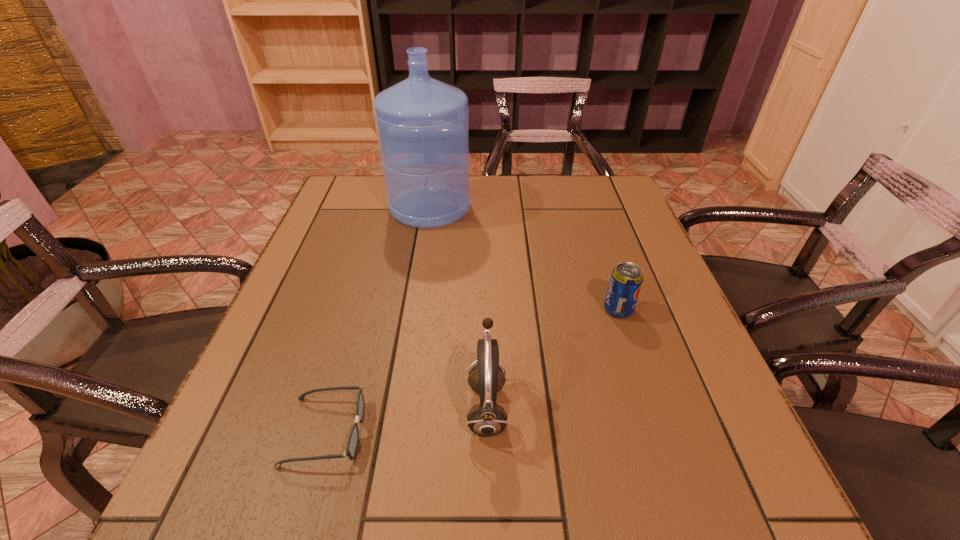
You are a GUI agent. You are given a task and a screenshot of the screen. Output one action in this format:
    pyautogui.click(x=<x>, y=<y>)
    Task: Click on the vacant space located 0.310m on the ear pads of the second tallest object
    This screenshot has height=540, width=960.
    Given the screenshot: What is the action you would take?
    pyautogui.click(x=288, y=407)

Where is `free space located 0.150m on the front of the soda`? free space located 0.150m on the front of the soda is located at coordinates (641, 380).

Where is `free space located 0.220m on the face of the spectacles`? The image size is (960, 540). free space located 0.220m on the face of the spectacles is located at coordinates (496, 431).

Locate an element on the screen. This screenshot has height=540, width=960. object present at the far edge is located at coordinates (423, 124).

Locate an element on the screen. Image resolution: width=960 pixels, height=540 pixels. object that is at the near edge is located at coordinates (352, 444).

What are the coordinates of `object that is at the left edge` in the screenshot? It's located at (352, 444).

Where is `object present at the right edge`? Image resolution: width=960 pixels, height=540 pixels. object present at the right edge is located at coordinates (626, 279).

I want to click on object that is at the near left corner, so click(x=352, y=444).

In the image, there is a desktop. In order to click on blank space at the far edge in this screenshot , I will do `click(516, 214)`.

You are a GUI agent. You are given a task and a screenshot of the screen. Output one action in this format:
    pyautogui.click(x=<x>, y=<y>)
    Task: Click on the vacant space at the near edge of the desktop
    The image size is (960, 540).
    Given the screenshot: What is the action you would take?
    (630, 483)